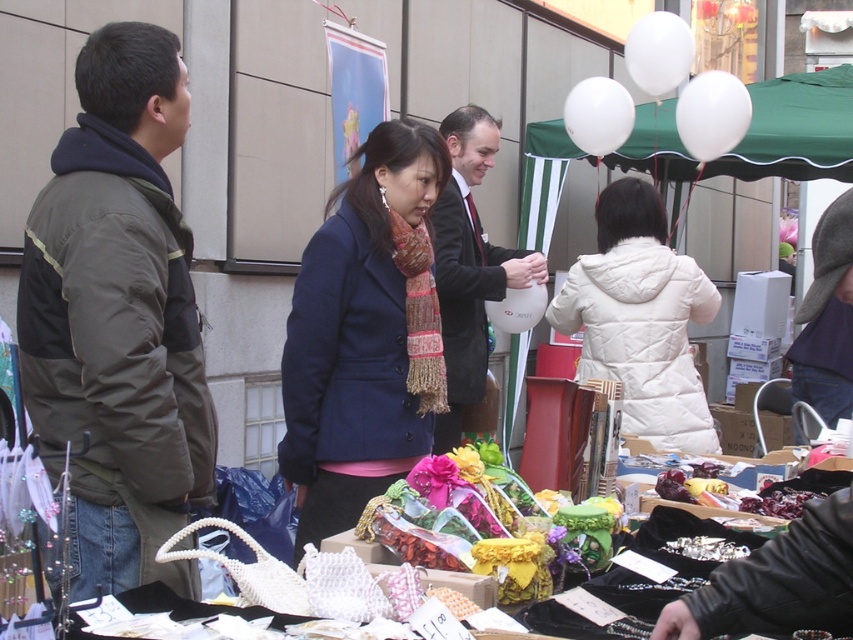
Question: Is dark green jacket at left positioned behind green fabric canopy at upper center?

Choices:
 (A) no
 (B) yes

Answer: (A)

Question: Which object appears closest to the camera in this image?

Choices:
 (A) navy blue coat at center
 (B) black suit at center
 (C) dark green jacket at left
 (D) knitted wool scarf at center

Answer: (C)

Question: Is black suit at center closer to the viewer compared to knitted wool scarf at center?

Choices:
 (A) no
 (B) yes

Answer: (A)

Question: Can you confirm if navy blue coat at center is thinner than green fabric canopy at upper center?

Choices:
 (A) no
 (B) yes

Answer: (B)

Question: Among these objects, which one is nearest to the camera?

Choices:
 (A) green fabric canopy at upper center
 (B) navy blue coat at center
 (C) knitted wool scarf at center
 (D) black suit at center

Answer: (B)

Question: Which point is farther to the camera?

Choices:
 (A) (758, 157)
 (B) (434, 234)
 (C) (430, 353)

Answer: (A)